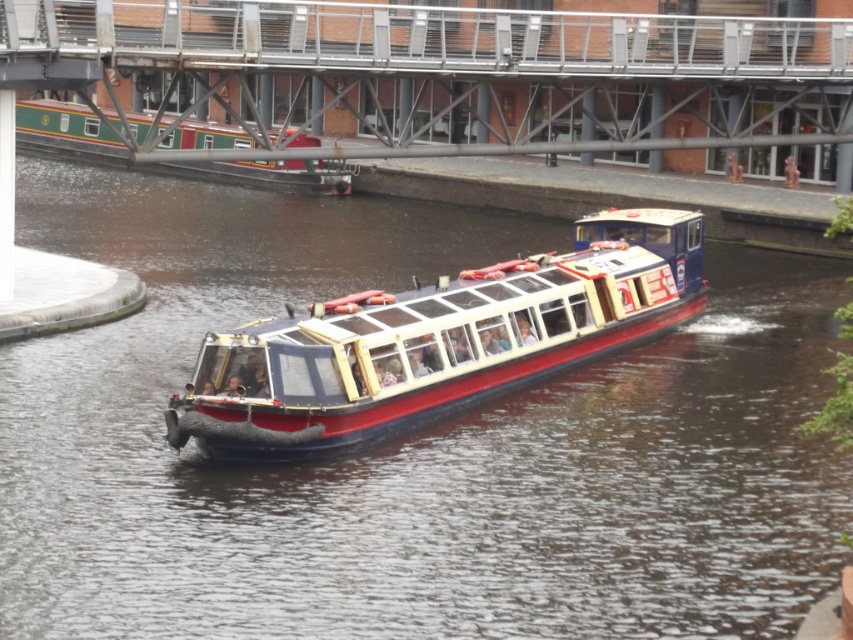
Is point (421, 42) positioned after point (567, 314)?

Yes, point (421, 42) is behind point (567, 314).

Is metallic gray bridge at upper center above red polished wood boat at center?

Indeed, metallic gray bridge at upper center is positioned over red polished wood boat at center.

This screenshot has height=640, width=853. I want to click on metallic gray bridge at upper center, so click(442, 81).

Who is taller, red polished wood boat at center or green polished wood boat at upper left?

Standing taller between the two is green polished wood boat at upper left.

Who is more forward, (444, 346) or (207, 136)?

Point (444, 346) is more forward.

Find the location of `red polished wood boat at center`. red polished wood boat at center is located at coordinates (437, 340).

Does metallic gray bridge at upper center appear on the right side of green polished wood boat at upper left?

Correct, you'll find metallic gray bridge at upper center to the right of green polished wood boat at upper left.

The image size is (853, 640). Identify the location of metallic gray bridge at upper center. 442,81.